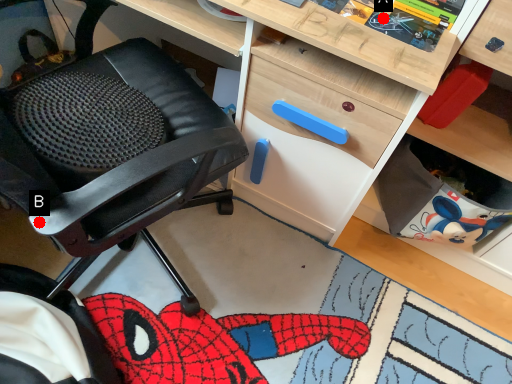
Question: Two points are circled on the image, labeled by A and B beside each circle. Which point is closer to the camera?

Choices:
 (A) A is closer
 (B) B is closer

Answer: (B)